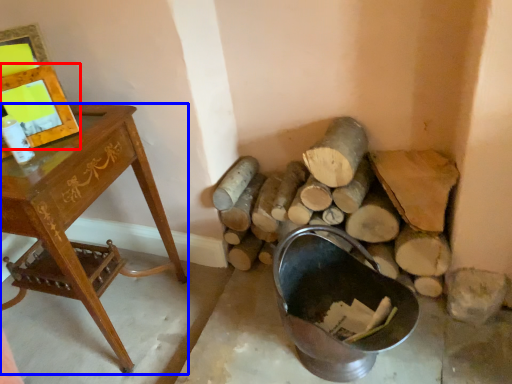
Question: Which point is closer to the camera, picture frame (highlighted by a red box) or desk (highlighted by a blue box)?

Choices:
 (A) picture frame
 (B) desk

Answer: (B)